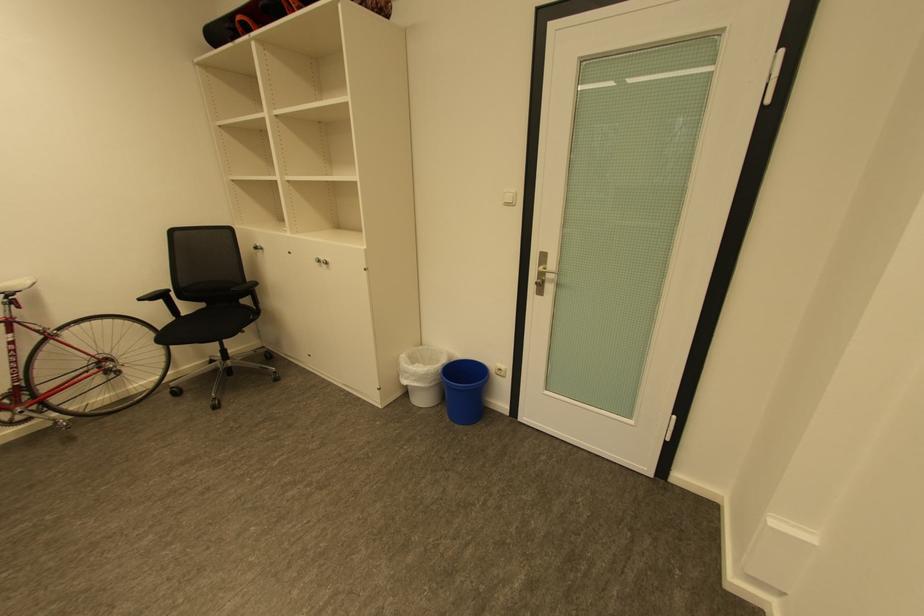
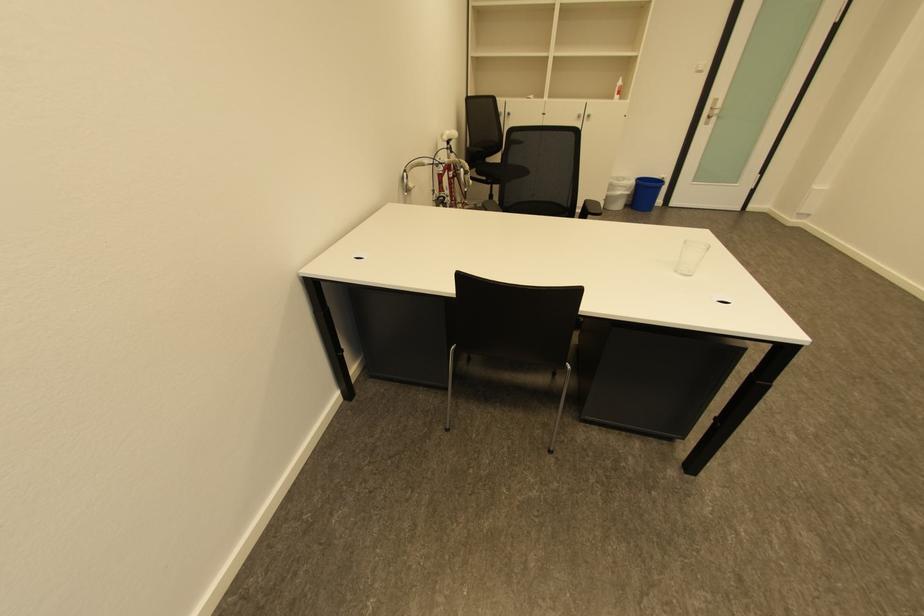
Question: Which direction would the cameraman need to move to produce the second image? Reply with the corresponding letter.

Choices:
 (A) Left
 (B) Right
 (C) Forward
 (D) Backward

Answer: (A)